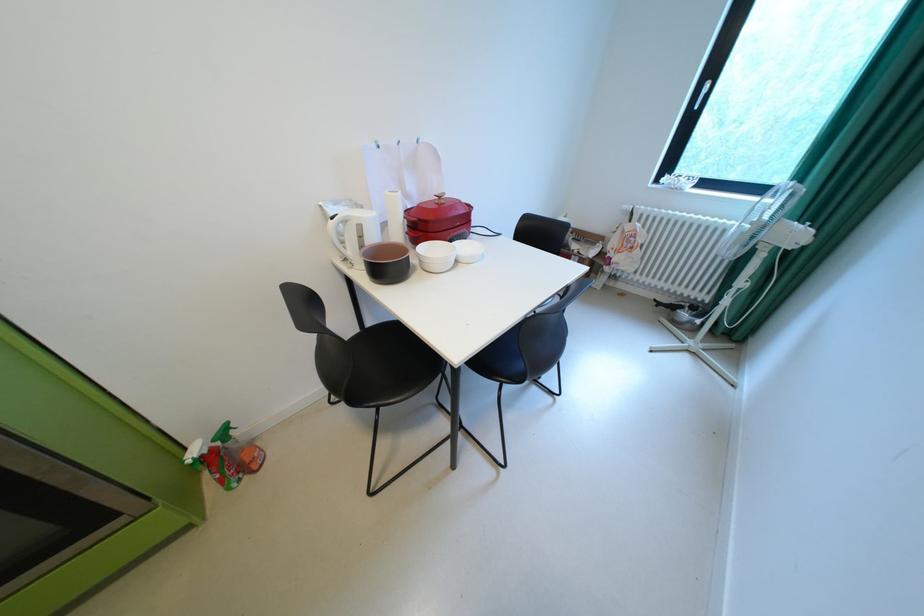
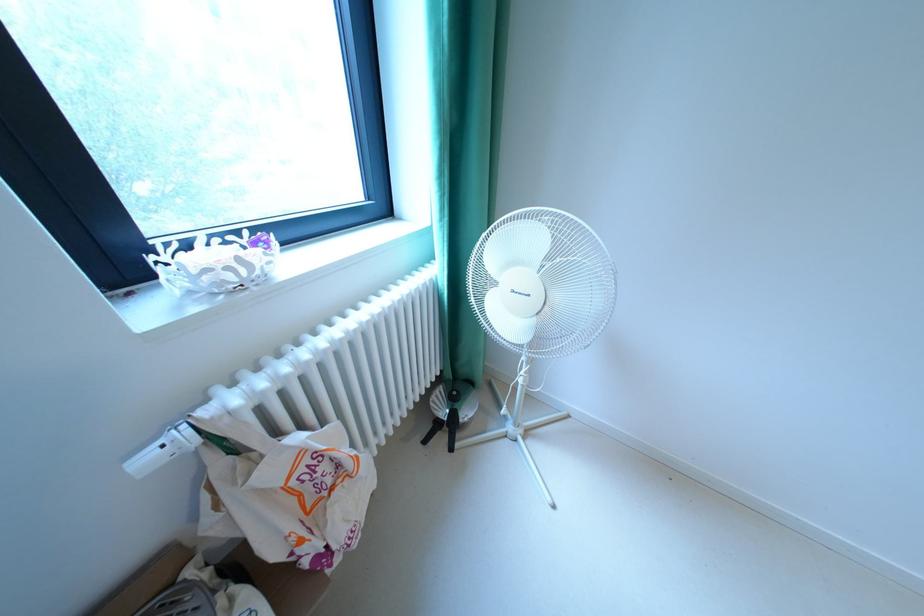
Locate, in the second image, the point that corresponds to the point at 636,208 in the first image.

(156, 460)